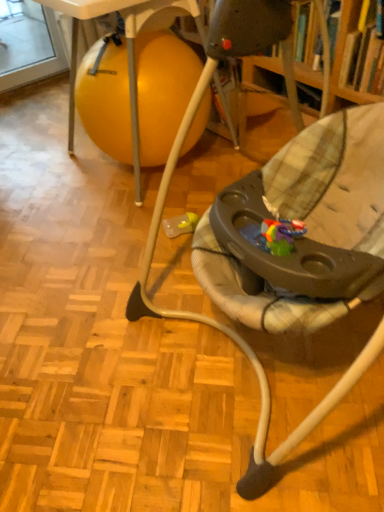
Question: Is black plastic walker at center oriented away from white plastic table at upper left?

Choices:
 (A) no
 (B) yes

Answer: (A)

Question: Can you confirm if black plastic walker at center is bigger than white plastic table at upper left?

Choices:
 (A) yes
 (B) no

Answer: (A)

Question: Can white plastic table at upper left be found inside black plastic walker at center?

Choices:
 (A) yes
 (B) no

Answer: (B)

Question: Can you confirm if black plastic walker at center is shorter than white plastic table at upper left?

Choices:
 (A) yes
 (B) no

Answer: (B)

Question: Does black plastic walker at center turn towards white plastic table at upper left?

Choices:
 (A) no
 (B) yes

Answer: (A)

Question: From the image's perspective, is black plastic walker at center under white plastic table at upper left?

Choices:
 (A) yes
 (B) no

Answer: (A)

Question: Is white plastic table at upper left not close to black plastic walker at center?

Choices:
 (A) yes
 (B) no

Answer: (B)

Question: Does white plastic table at upper left appear on the right side of black plastic walker at center?

Choices:
 (A) no
 (B) yes

Answer: (A)

Question: From the image's perspective, is white plastic table at upper left located above black plastic walker at center?

Choices:
 (A) yes
 (B) no

Answer: (A)

Question: Is white plastic table at upper left looking in the opposite direction of black plastic walker at center?

Choices:
 (A) no
 (B) yes

Answer: (A)

Question: From a real-world perspective, is white plastic table at upper left located beneath black plastic walker at center?

Choices:
 (A) yes
 (B) no

Answer: (A)

Question: From the image's perspective, does white plastic table at upper left appear lower than black plastic walker at center?

Choices:
 (A) yes
 (B) no

Answer: (B)

Question: Considering the relative positions of black plastic walker at center and white plastic table at upper left in the image provided, is black plastic walker at center to the left or to the right of white plastic table at upper left?

Choices:
 (A) left
 (B) right

Answer: (B)